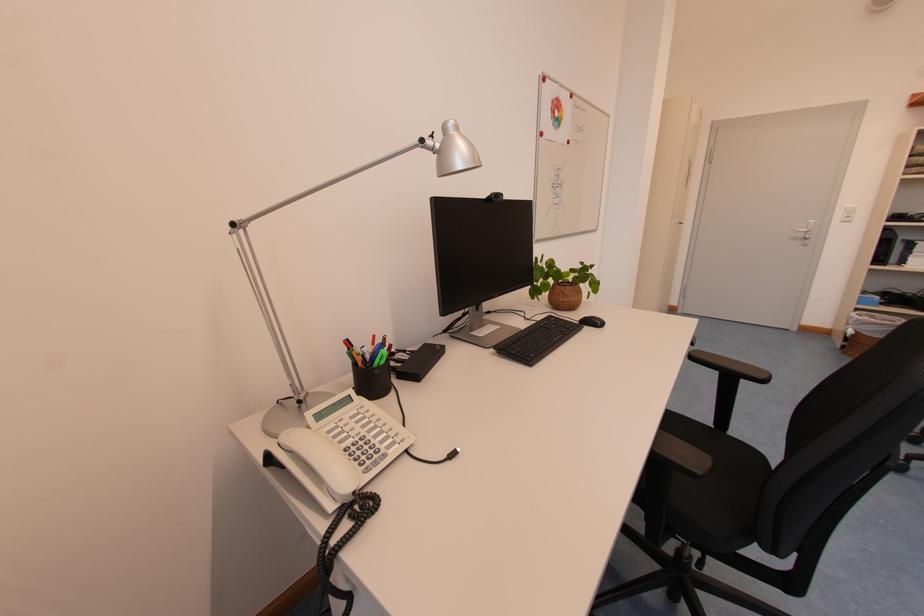
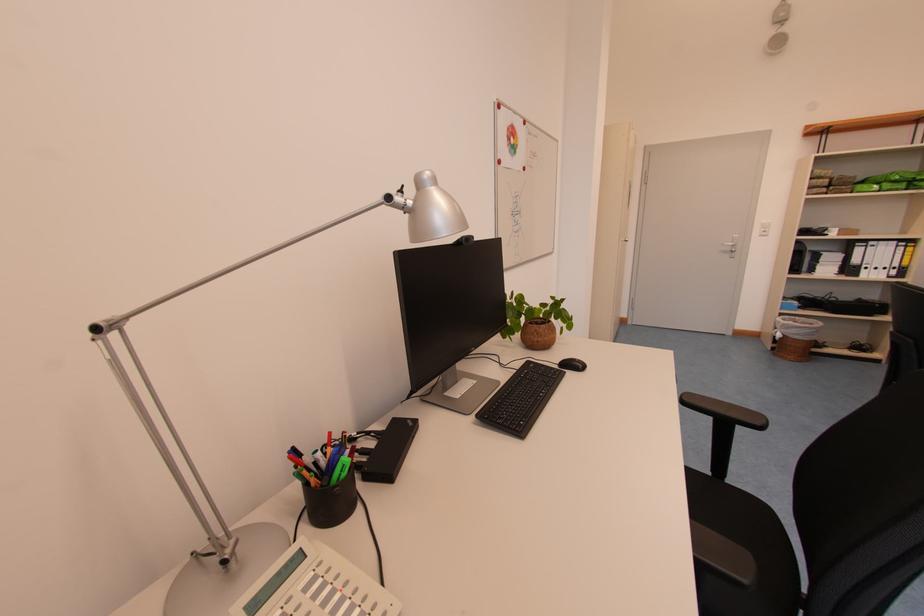
Locate, in the second image, the point that corresponds to pixel 548 76 in the first image.

(503, 103)